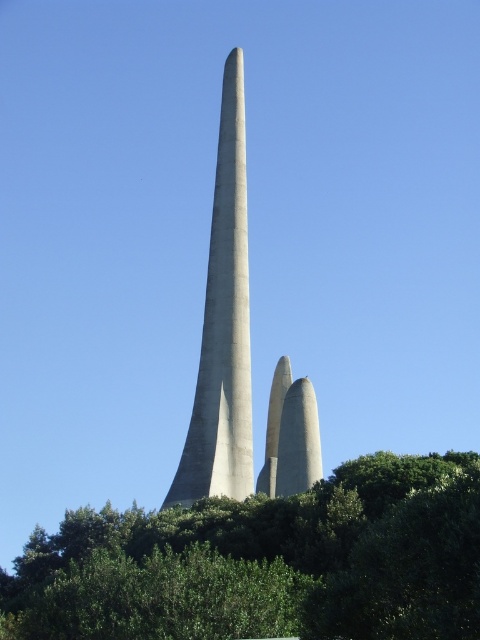
You are standing in front of the gray concrete tower at center and want to see the green leafy tree at center. Is the tree taller than the tower?

The green leafy tree at center is bigger than gray concrete tower at center, so yes, the tree is taller than the tower.

You are planning to install a new bench in the park. The bench requires a space that is wider than the smooth concrete twin towers at center. Is the green leafy tree at center a suitable location for the bench?

The green leafy tree at center might be wider than the smooth concrete twin towers at center, so it could potentially be a suitable location for the bench if the bench requires a space wider than the towers.

You are an architect evaluating the spatial compatibility of these structures. Given that the gray concrete tower at center must be placed in a central location, can the smooth concrete twin towers at center be positioned symmetrically on either side of it without overlapping?

The gray concrete tower at center is larger in size than the smooth concrete twin towers at center. Since the twin towers are smaller, they can be placed symmetrically on either side of the central tower without overlapping, provided there is sufficient space between them and the larger structure.